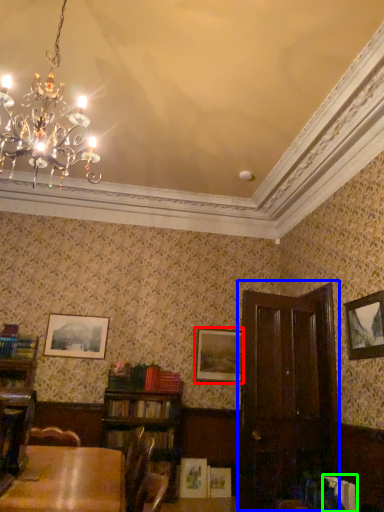
Question: Which object is positioned farthest from picture frame (highlighted by a red box)? Select from armoire (highlighted by a blue box) and book (highlighted by a green box).

Choices:
 (A) armoire
 (B) book

Answer: (B)